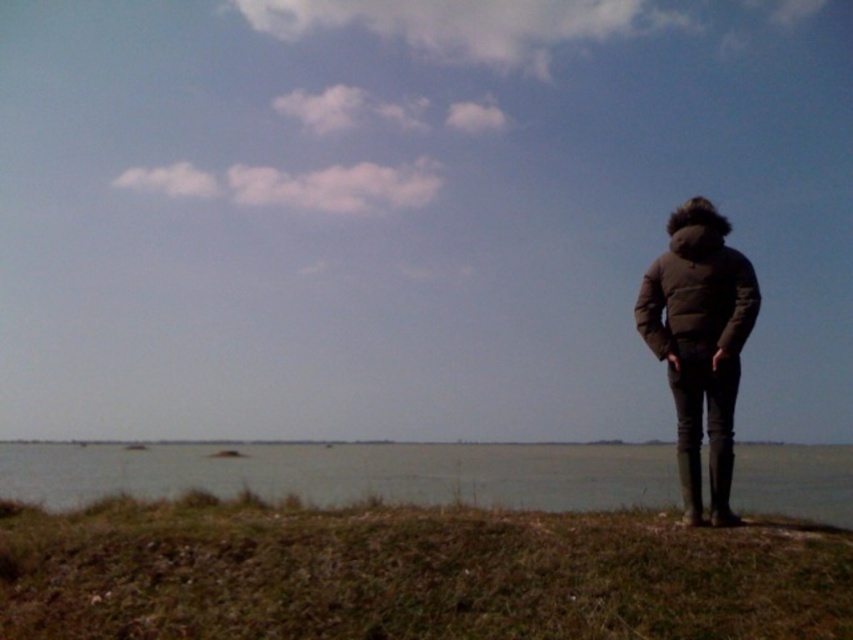
Does green grass at lower right appear on the left side of gray matte water at lower center?

Indeed, green grass at lower right is positioned on the left side of gray matte water at lower center.

Is green grass at lower right taller than gray matte water at lower center?

No.

I want to click on green grass at lower right, so click(x=410, y=573).

You are a GUI agent. You are given a task and a screenshot of the screen. Output one action in this format:
    pyautogui.click(x=<x>, y=<y>)
    Task: Click on the green grass at lower right
    This screenshot has height=640, width=853.
    Given the screenshot: What is the action you would take?
    tap(410, 573)

Does green grass at lower right have a lesser width compared to matte black jacket at right?

Incorrect, green grass at lower right's width is not less than matte black jacket at right's.

Is green grass at lower right below matte black jacket at right?

Yes.

At what (x,y) coordinates should I click in order to perform the action: click on green grass at lower right. Please return your answer as a coordinate pair (x, y). Looking at the image, I should click on (410, 573).

Does gray matte water at lower center lie behind matte black jacket at right?

No.

Does gray matte water at lower center have a greater height compared to matte black jacket at right?

Yes, gray matte water at lower center is taller than matte black jacket at right.

Is point (769, 451) positioned behind point (693, 248)?

That is True.

You are a GUI agent. You are given a task and a screenshot of the screen. Output one action in this format:
    pyautogui.click(x=<x>, y=<y>)
    Task: Click on the gray matte water at lower center
    This screenshot has width=853, height=640.
    Given the screenshot: What is the action you would take?
    pyautogui.click(x=351, y=474)